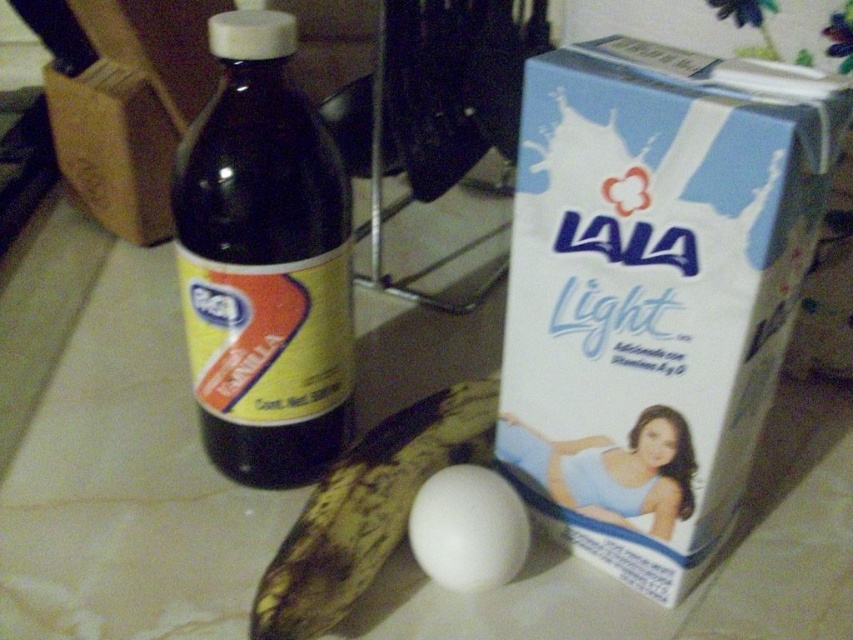
You are standing in front of the kitchen countertop and want to place a new item exactly at the point with coordinates (264, 262). What object is currently located at that point?

The point with coordinates (264, 262) corresponds to the dark glass bottle at center.

You are taking a photo of the kitchen countertop and want to focus on both point (x=277, y=355) and point (x=299, y=540). Which point is closer to your camera?

Point (x=277, y=355) is further to the camera than point (x=299, y=540), so point (x=299, y=540) is closer to the camera.